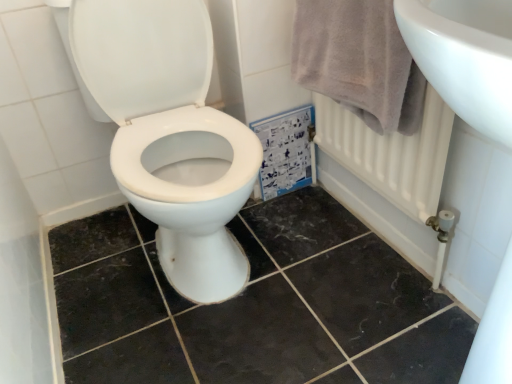
Question: From the image's perspective, is light gray cotton towel at upper right beneath black marble tile at center?

Choices:
 (A) no
 (B) yes

Answer: (A)

Question: Considering the relative sizes of light gray cotton towel at upper right and black marble tile at center in the image provided, is light gray cotton towel at upper right shorter than black marble tile at center?

Choices:
 (A) yes
 (B) no

Answer: (B)

Question: Does light gray cotton towel at upper right come in front of black marble tile at center?

Choices:
 (A) yes
 (B) no

Answer: (B)

Question: Does light gray cotton towel at upper right have a greater height compared to black marble tile at center?

Choices:
 (A) yes
 (B) no

Answer: (A)

Question: Is black marble tile at center at the back of light gray cotton towel at upper right?

Choices:
 (A) no
 (B) yes

Answer: (A)

Question: Is point (421, 96) positioned closer to the camera than point (152, 332)?

Choices:
 (A) closer
 (B) farther

Answer: (A)

Question: From a real-world perspective, is light gray cotton towel at upper right above or below black marble tile at center?

Choices:
 (A) above
 (B) below

Answer: (A)

Question: From their relative heights in the image, would you say light gray cotton towel at upper right is taller or shorter than black marble tile at center?

Choices:
 (A) short
 (B) tall

Answer: (B)

Question: Considering their positions, is light gray cotton towel at upper right located in front of or behind black marble tile at center?

Choices:
 (A) behind
 (B) front

Answer: (A)

Question: In the image, is black marble tile at center on the left side or the right side of white glossy toilet at center?

Choices:
 (A) left
 (B) right

Answer: (B)

Question: Considering the positions of black marble tile at center and white glossy toilet at center in the image, is black marble tile at center wider or thinner than white glossy toilet at center?

Choices:
 (A) wide
 (B) thin

Answer: (A)

Question: From a real-world perspective, is black marble tile at center positioned above or below white glossy toilet at center?

Choices:
 (A) above
 (B) below

Answer: (B)

Question: From the image's perspective, is black marble tile at center located above or below white glossy toilet at center?

Choices:
 (A) above
 (B) below

Answer: (B)

Question: Considering the positions of white glossy toilet at center and light gray cotton towel at upper right in the image, is white glossy toilet at center taller or shorter than light gray cotton towel at upper right?

Choices:
 (A) tall
 (B) short

Answer: (A)

Question: From a real-world perspective, is white glossy toilet at center above or below light gray cotton towel at upper right?

Choices:
 (A) above
 (B) below

Answer: (B)